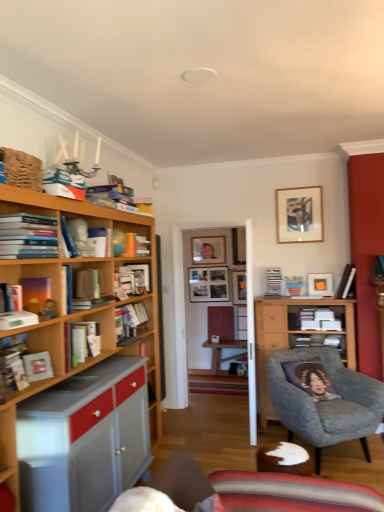
The width and height of the screenshot is (384, 512). Describe the element at coordinates (81, 342) in the screenshot. I see `hardcover book at left, which ranks as the seventh book in front-to-back order` at that location.

Describe the element at coordinates (87, 290) in the screenshot. I see `matte brown book at left, which is counted as the seventh book, starting from the left` at that location.

Image resolution: width=384 pixels, height=512 pixels. In order to click on hardcover book at center, the twelfth book in the front-to-back sequence in this screenshot , I will do `click(273, 282)`.

Measure the distance between hardcover book at left, which appears as the first book when viewed from the left, and camera.

7.03 feet.

What is the approximate width of matte white book at left, which is the 5th book in left-to-right order?

It is 3.17 inches.

How much space does matte black picture frame at upper center, arranged as the first picture frame when viewed from the back, occupy horizontally?

It is 1.55 inches.

How much space does matte black picture frame at upper center, positioned as the fourth picture frame in front-to-back order, occupy vertically?

matte black picture frame at upper center, positioned as the fourth picture frame in front-to-back order, is 17.17 inches tall.

Identify the location of hardcover book at left, the seventh book positioned from the right. (81, 342).

Starting from the hardcover book at upper right, which appears as the 11th book when viewed from the front, which book is the 6th one to the left? Please provide its 2D coordinates.

[(81, 342)]

Is hardcover book at upper right, positioned as the 12th book in left-to-right order, wider than hardcover book at left, which is counted as the sixth book, starting from the back?

Yes, hardcover book at upper right, positioned as the 12th book in left-to-right order, is wider than hardcover book at left, which is counted as the sixth book, starting from the back.

Considering the relative sizes of hardcover book at upper right, positioned as the 12th book in left-to-right order, and hardcover book at left, which ranks as the seventh book in front-to-back order, in the image provided, is hardcover book at upper right, positioned as the 12th book in left-to-right order, smaller than hardcover book at left, which ranks as the seventh book in front-to-back order,?

No, hardcover book at upper right, positioned as the 12th book in left-to-right order, is not smaller than hardcover book at left, which ranks as the seventh book in front-to-back order.

From the picture: Measure the distance from hardcover book at upper right, which is the second book in back-to-front order, to hardcover book at left, the seventh book positioned from the right.

A distance of 8.17 feet exists between hardcover book at upper right, which is the second book in back-to-front order, and hardcover book at left, the seventh book positioned from the right.

Is hardcover book at center, which appears as the 11th book when viewed from the left, spatially inside wooden table at center, or outside of it?

hardcover book at center, which appears as the 11th book when viewed from the left, is located beyond the bounds of wooden table at center.

From the picture: Is hardcover book at center, which is the 1th book from back to front, with wooden table at center?

hardcover book at center, which is the 1th book from back to front, and wooden table at center are not in contact.

Is hardcover book at center, which appears as the 11th book when viewed from the left, in front of or behind wooden table at center in the image?

hardcover book at center, which appears as the 11th book when viewed from the left, is positioned closer to the viewer than wooden table at center.

In the scene shown: Is hardcover book at center, the twelfth book in the front-to-back sequence, wider than wooden table at center?

In fact, hardcover book at center, the twelfth book in the front-to-back sequence, might be narrower than wooden table at center.

Considering the relative positions of hardcover books at left, which ranks as the 10th book in right-to-left order, and matte white book at left, the ninth book positioned from the back, in the image provided, is hardcover books at left, which ranks as the 10th book in right-to-left order, to the left of matte white book at left, the ninth book positioned from the back, from the viewer's perspective?

Indeed, hardcover books at left, which ranks as the 10th book in right-to-left order, is positioned on the left side of matte white book at left, the ninth book positioned from the back.

Where is `book that is the 11th one when counting downward from the hardcover books at left, which ranks as the 10th book in right-to-left order (from the image's perspective)`? The image size is (384, 512). book that is the 11th one when counting downward from the hardcover books at left, which ranks as the 10th book in right-to-left order (from the image's perspective) is located at coordinates (38, 366).

Looking at this image, based on their sizes in the image, would you say hardcover books at left, which ranks as the 12th book in back-to-front order, is bigger or smaller than matte white book at left, the ninth book positioned from the back?

Considering their sizes, hardcover books at left, which ranks as the 12th book in back-to-front order, takes up more space than matte white book at left, the ninth book positioned from the back.

Which is in front, hardcover books at left, positioned as the 1th book in front-to-back order, or matte white book at left, placed as the fourth book when sorted from front to back?

hardcover books at left, positioned as the 1th book in front-to-back order.

Can you confirm if hardcover book at center, the 9th book from the left, is thinner than matte white picture frame at upper right, which is the 4th picture frame in back-to-front order?

No.

Which of these two, hardcover book at center, the 9th book from the left, or matte white picture frame at upper right, which is the 4th picture frame in back-to-front order, is bigger?

Bigger between the two is hardcover book at center, the 9th book from the left.

Based on the photo, would you say matte white picture frame at upper right, placed as the first picture frame when sorted from front to back, is part of hardcover book at center, positioned as the 4th book in right-to-left order,'s contents?

No, matte white picture frame at upper right, placed as the first picture frame when sorted from front to back, is not a part of hardcover book at center, positioned as the 4th book in right-to-left order.

Where is `the 1st picture frame behind the hardcover book at center, the 9th book from the left, counting from the anchor's position`? The image size is (384, 512). the 1st picture frame behind the hardcover book at center, the 9th book from the left, counting from the anchor's position is located at coordinates (320, 284).

Considering the sizes of hardcover book at upper right, positioned as the 12th book in left-to-right order, and velvet grey armchair at lower right in the image, is hardcover book at upper right, positioned as the 12th book in left-to-right order, bigger or smaller than velvet grey armchair at lower right?

Considering their sizes, hardcover book at upper right, positioned as the 12th book in left-to-right order, takes up less space than velvet grey armchair at lower right.

From the image's perspective, between hardcover book at upper right, which is the second book in back-to-front order, and velvet grey armchair at lower right, who is located below?

velvet grey armchair at lower right.

Can you confirm if hardcover book at upper right, which is the second book in back-to-front order, is thinner than velvet grey armchair at lower right?

Yes.

From a real-world perspective, does hardcover book at upper right, which appears as the 11th book when viewed from the front, sit lower than velvet grey armchair at lower right?

No, from a real-world perspective, hardcover book at upper right, which appears as the 11th book when viewed from the front, is not below velvet grey armchair at lower right.

Is hardcover book at center, which is the 1th book from back to front, shorter than orange matte bookshelf at upper center, which is the 10th book from left to right?

In fact, hardcover book at center, which is the 1th book from back to front, may be taller than orange matte bookshelf at upper center, which is the 10th book from left to right.

From a real-world perspective, which is physically below, hardcover book at center, which is the 1th book from back to front, or orange matte bookshelf at upper center, the 4th book in the back-to-front sequence?

hardcover book at center, which is the 1th book from back to front, is physically lower.

Where is `the 5th book above the hardcover book at center, the 2th book viewed from the right (from a real-world perspective)`? This screenshot has width=384, height=512. the 5th book above the hardcover book at center, the 2th book viewed from the right (from a real-world perspective) is located at coordinates (136, 246).

How different are the orientations of wooden bookshelf at right and matte black picture frame at upper center, arranged as the first picture frame when viewed from the back, in degrees?

1.2 degrees separate the facing orientations of wooden bookshelf at right and matte black picture frame at upper center, arranged as the first picture frame when viewed from the back.

Does point (350, 346) lie in front of point (196, 238)?

Yes.

Is wooden bookshelf at right surrounding matte black picture frame at upper center, positioned as the fourth picture frame in front-to-back order?

No, wooden bookshelf at right does not contain matte black picture frame at upper center, positioned as the fourth picture frame in front-to-back order.

Is wooden bookshelf at right at the right side of matte black picture frame at upper center, arranged as the first picture frame when viewed from the back?

Yes.

This screenshot has height=512, width=384. Identify the location of the 6th book to the right of the hardcover book at left, which is the sixth book from left to right, counting from the anchor's position. (345, 282).

You are a GUI agent. You are given a task and a screenshot of the screen. Output one action in this format:
    pyautogui.click(x=<x>, y=<y>)
    Task: Click on the book that is the 6th one above the wooden table at center (from a real-world perspective)
    This screenshot has height=512, width=384.
    Given the screenshot: What is the action you would take?
    pyautogui.click(x=273, y=282)

When comparing their distances from matte black picture frame at upper center, arranged as the first picture frame when viewed from the back, does hardcover book at center, the eighth book in the left-to-right sequence, or matte purple book at left, which ranks as the fifth book in front-to-back order, seem further?

matte purple book at left, which ranks as the fifth book in front-to-back order, is further to matte black picture frame at upper center, arranged as the first picture frame when viewed from the back.

Looking at the image, which one is located closer to hardcover book at left, the eleventh book from the back, hardcover book at upper right, which is the second book in back-to-front order, or hardcover book at left, marked as the 2th book in a left-to-right arrangement?

hardcover book at left, marked as the 2th book in a left-to-right arrangement, lies closer to hardcover book at left, the eleventh book from the back, than the other object.

Based on their spatial positions, is hardcover book at left, the seventh book positioned from the right, or hardcover books at left, which appears as the third book when viewed from the left, closer to wooden bookshelf at right?

hardcover book at left, the seventh book positioned from the right.

When comparing their distances from wooden picture frame at upper right, which ranks as the second picture frame in front-to-back order, does matte brown book at left, which is the 7th book from back to front, or matte black picture frame at upper center, positioned as the fourth picture frame in front-to-back order, seem further?

Based on the image, matte brown book at left, which is the 7th book from back to front, appears to be further to wooden picture frame at upper right, which ranks as the second picture frame in front-to-back order.

When comparing their distances from hardcover book at center, the 5th book when ordered from right to left, does wooden picture frame at upper right, which ranks as the second picture frame in front-to-back order, or wooden table at center seem closer?

wooden picture frame at upper right, which ranks as the second picture frame in front-to-back order, lies closer to hardcover book at center, the 5th book when ordered from right to left, than the other object.

Looking at the image, which one is located further to orange matte bookshelf at upper center, which is the 3th book from right to left, matte black picture frame at upper center, positioned as the fourth picture frame in front-to-back order, or hardcover book at left, which is the 2th book from front to back?

matte black picture frame at upper center, positioned as the fourth picture frame in front-to-back order.

Looking at the image, which one is located closer to matte white book at left, which is the 5th book in left-to-right order, wooden bookshelf at right or matte brown book at left, which is the 7th book from back to front?

Based on the image, matte brown book at left, which is the 7th book from back to front, appears to be nearer to matte white book at left, which is the 5th book in left-to-right order.

Looking at the image, which one is located further to wooden bookshelf at right, black matte picture frame at center, the second picture frame viewed from the back, or matte purple book at left, which is the 4th book in left-to-right order?

matte purple book at left, which is the 4th book in left-to-right order, lies further to wooden bookshelf at right than the other object.

This screenshot has width=384, height=512. I want to click on book located between matte brown book at left, arranged as the sixth book when viewed from the front, and hardcover book at center, the 5th book when ordered from right to left, in the depth direction, so click(x=81, y=342).

Find the location of a particular element. chair between matte purple book at left, which ranks as the fifth book in front-to-back order, and hardcover book at upper right, positioned as the 12th book in left-to-right order is located at coordinates (325, 401).

The image size is (384, 512). I want to click on chair located between matte brown book at left, arranged as the sixth book when viewed from the front, and wooden bookshelf at right in the left-right direction, so click(x=325, y=401).

Where is `chair between hardcover books at left, positioned as the 1th book in front-to-back order, and hardcover book at center, the twelfth book in the front-to-back sequence, in the front-back direction`? The width and height of the screenshot is (384, 512). chair between hardcover books at left, positioned as the 1th book in front-to-back order, and hardcover book at center, the twelfth book in the front-to-back sequence, in the front-back direction is located at coordinates (325, 401).